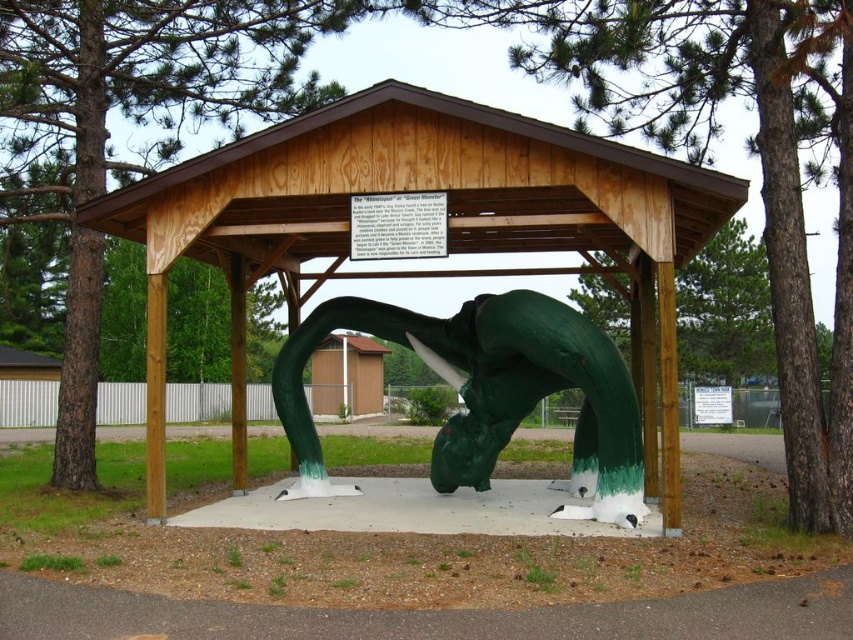
Question: Can you confirm if green painted wood gazebo at center is thinner than green matte tree at center?

Choices:
 (A) no
 (B) yes

Answer: (B)

Question: Estimate the real-world distances between objects in this image. Which object is closer to the green matte tree at center?

Choices:
 (A) green painted wood gazebo at center
 (B) green matte whale at center

Answer: (A)

Question: Can you confirm if green matte tree at center is positioned below green matte tree trunk at center?

Choices:
 (A) yes
 (B) no

Answer: (A)

Question: Based on their relative distances, which object is farther from the green matte whale at center?

Choices:
 (A) green matte tree trunk at center
 (B) green painted wood gazebo at center

Answer: (A)

Question: Is green matte tree at center smaller than green matte whale at center?

Choices:
 (A) yes
 (B) no

Answer: (B)

Question: Among these objects, which one is nearest to the camera?

Choices:
 (A) green painted wood gazebo at center
 (B) green matte tree at center

Answer: (B)